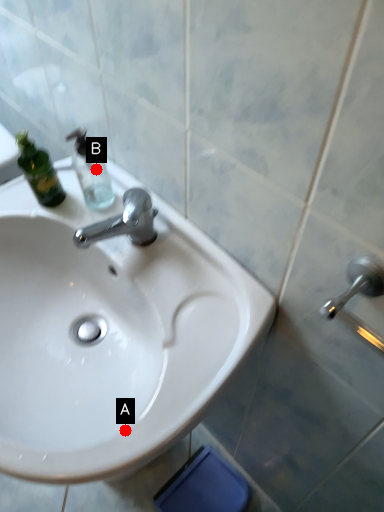
Question: Two points are circled on the image, labeled by A and B beside each circle. Among these points, which one is nearest to the camera?

Choices:
 (A) A is closer
 (B) B is closer

Answer: (A)